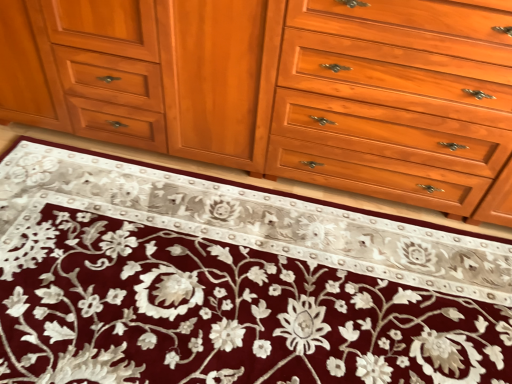
Question: Is the position of matte wood cabinet at center more distant than that of light brown wood drawer at center?

Choices:
 (A) no
 (B) yes

Answer: (B)

Question: Is matte wood cabinet at center not near light brown wood drawer at center?

Choices:
 (A) yes
 (B) no

Answer: (B)

Question: Does matte wood cabinet at center turn towards light brown wood drawer at center?

Choices:
 (A) no
 (B) yes

Answer: (A)

Question: Is matte wood cabinet at center taller than light brown wood drawer at center?

Choices:
 (A) yes
 (B) no

Answer: (B)

Question: From a real-world perspective, is matte wood cabinet at center physically below light brown wood drawer at center?

Choices:
 (A) no
 (B) yes

Answer: (B)

Question: In terms of width, does matte wood cabinet at center look wider or thinner when compared to maroon velvet rug at center?

Choices:
 (A) wide
 (B) thin

Answer: (B)

Question: Would you say matte wood cabinet at center is to the left or to the right of maroon velvet rug at center in the picture?

Choices:
 (A) left
 (B) right

Answer: (A)

Question: From a real-world perspective, is matte wood cabinet at center physically located above or below maroon velvet rug at center?

Choices:
 (A) above
 (B) below

Answer: (A)

Question: Does point (13, 13) appear closer or farther from the camera than point (257, 238)?

Choices:
 (A) closer
 (B) farther

Answer: (A)

Question: Considering the positions of maroon velvet rug at center and light brown wood drawer at center in the image, is maroon velvet rug at center taller or shorter than light brown wood drawer at center?

Choices:
 (A) short
 (B) tall

Answer: (A)

Question: Considering the relative positions of maroon velvet rug at center and light brown wood drawer at center in the image provided, is maroon velvet rug at center to the left or to the right of light brown wood drawer at center?

Choices:
 (A) left
 (B) right

Answer: (A)

Question: Is maroon velvet rug at center bigger or smaller than light brown wood drawer at center?

Choices:
 (A) small
 (B) big

Answer: (A)

Question: Considering the positions of maroon velvet rug at center and light brown wood drawer at center in the image, is maroon velvet rug at center wider or thinner than light brown wood drawer at center?

Choices:
 (A) thin
 (B) wide

Answer: (B)

Question: Is maroon velvet rug at center wider or thinner than matte wood cabinet at center?

Choices:
 (A) wide
 (B) thin

Answer: (A)

Question: Is maroon velvet rug at center situated inside matte wood cabinet at center or outside?

Choices:
 (A) inside
 (B) outside

Answer: (B)